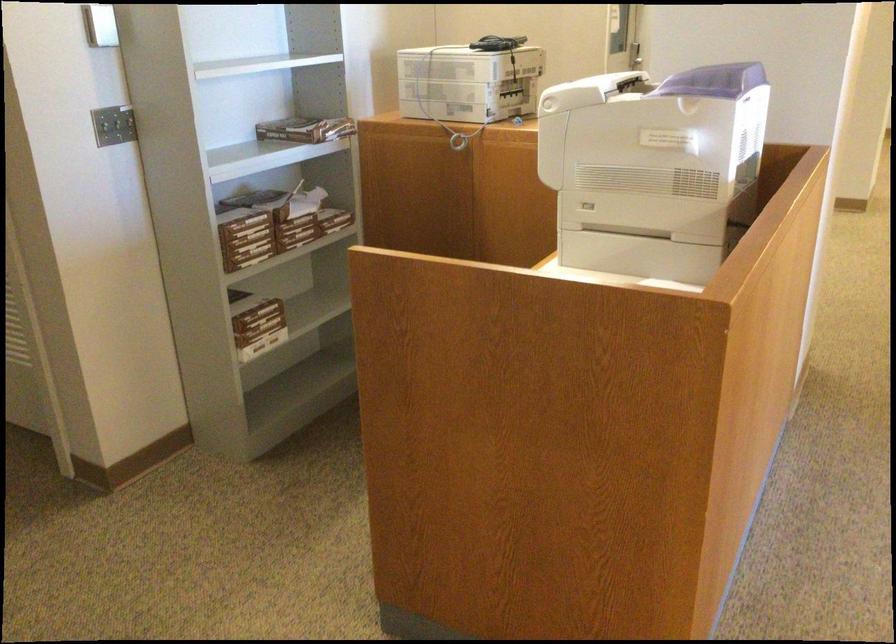
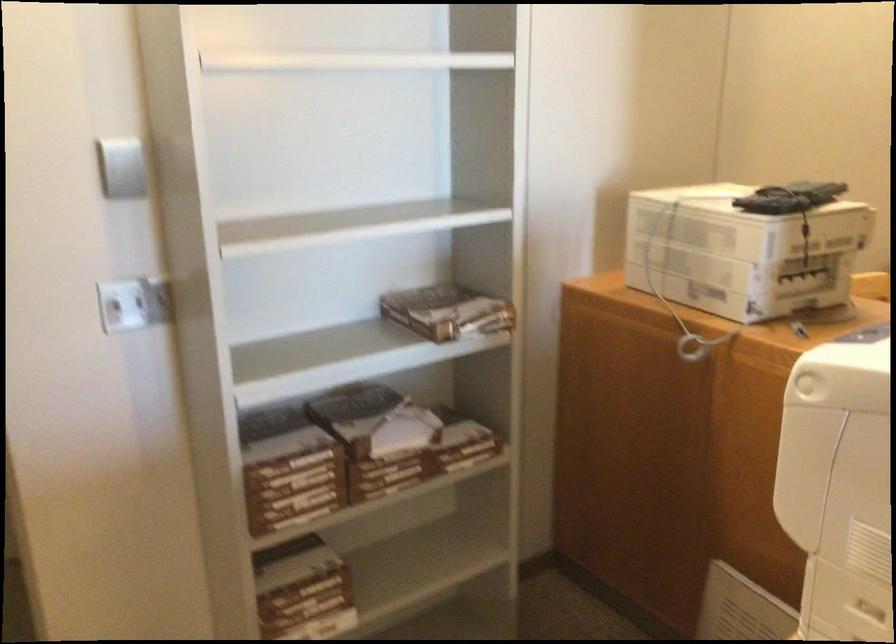
Question: The images are taken continuously from a first-person perspective. In which direction are you moving?

Choices:
 (A) Left
 (B) Right
 (C) Forward
 (D) Backward

Answer: (C)